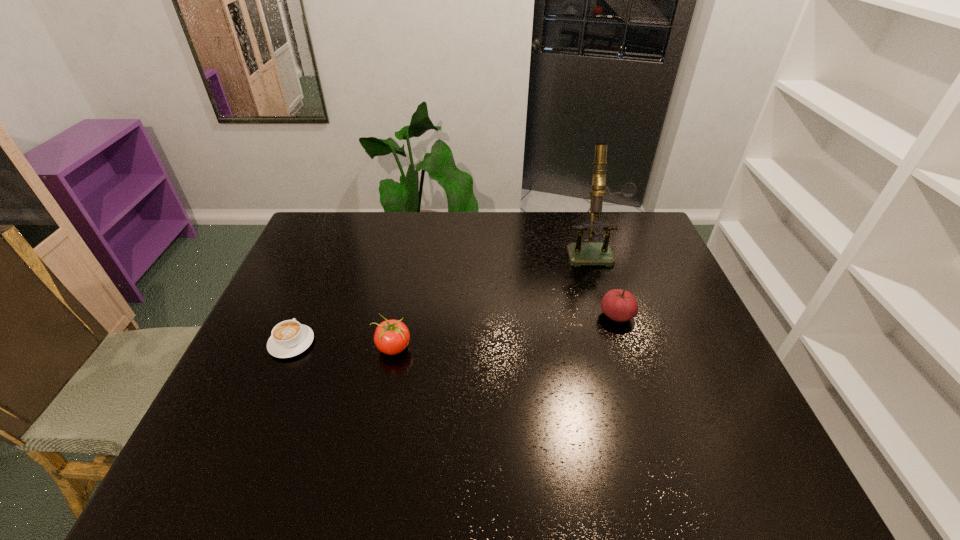
Where is `vacant space located on the side of the leftmost object with the handle`? vacant space located on the side of the leftmost object with the handle is located at coordinates (317, 282).

This screenshot has height=540, width=960. In order to click on vacant region located on the side of the leftmost object with the handle in this screenshot , I will do `click(329, 253)`.

The width and height of the screenshot is (960, 540). In order to click on vacant region located on the side of the leftmost object with the handle in this screenshot , I will do `click(324, 266)`.

Where is `object positioned at the far edge`? object positioned at the far edge is located at coordinates (579, 253).

At what (x,y) coordinates should I click in order to perform the action: click on object that is at the left edge. Please return your answer as a coordinate pair (x, y). Looking at the image, I should click on (289, 338).

The image size is (960, 540). Find the location of `object located at the right edge`. object located at the right edge is located at coordinates (579, 253).

Identify the location of object that is positioned at the far right corner. This screenshot has height=540, width=960. (579, 253).

The height and width of the screenshot is (540, 960). In the image, there is a desktop. Identify the location of vacant area at the far edge. (485, 233).

The width and height of the screenshot is (960, 540). I want to click on vacant space at the left edge of the desktop, so click(274, 310).

This screenshot has width=960, height=540. Find the location of `vacant area at the right edge of the desktop`. vacant area at the right edge of the desktop is located at coordinates (647, 301).